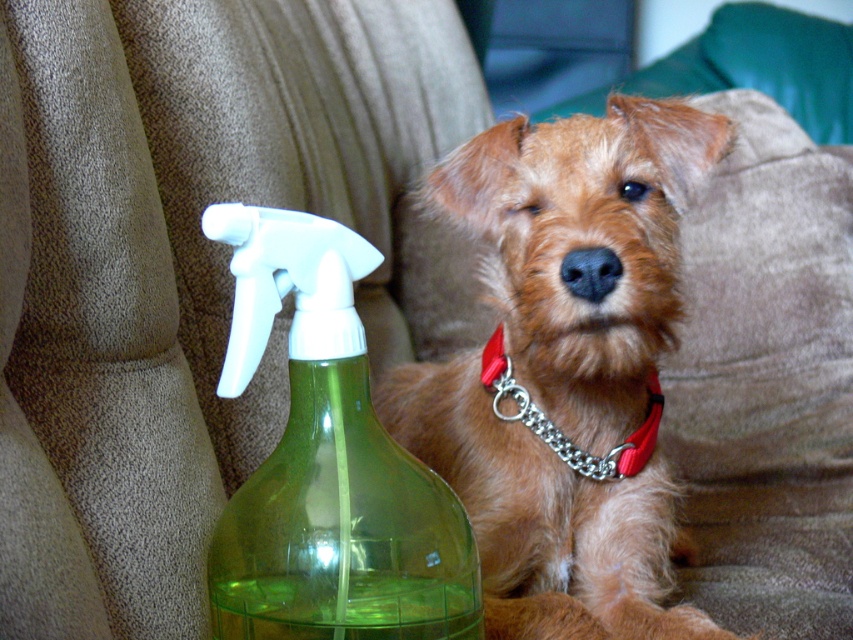
Does green translucent bottle at center have a lesser height compared to red chain collar at center?

No, green translucent bottle at center is not shorter than red chain collar at center.

Is point (316, 292) in front of point (544, 432)?

Yes.

Where is `green translucent bottle at center`? The height and width of the screenshot is (640, 853). green translucent bottle at center is located at coordinates (328, 461).

Between shiny brown fur at center and red chain collar at center, which one has less height?

red chain collar at center is shorter.

Can you confirm if shiny brown fur at center is bigger than red chain collar at center?

Indeed, shiny brown fur at center has a larger size compared to red chain collar at center.

Is point (494, 600) closer to camera compared to point (637, 452)?

Yes, it is.

Identify the location of shiny brown fur at center. (566, 368).

Is shiny brown fur at center above green translucent bottle at center?

No, shiny brown fur at center is not above green translucent bottle at center.

Identify the location of shiny brown fur at center. Image resolution: width=853 pixels, height=640 pixels. (566, 368).

Locate an element on the screen. shiny brown fur at center is located at coordinates point(566,368).